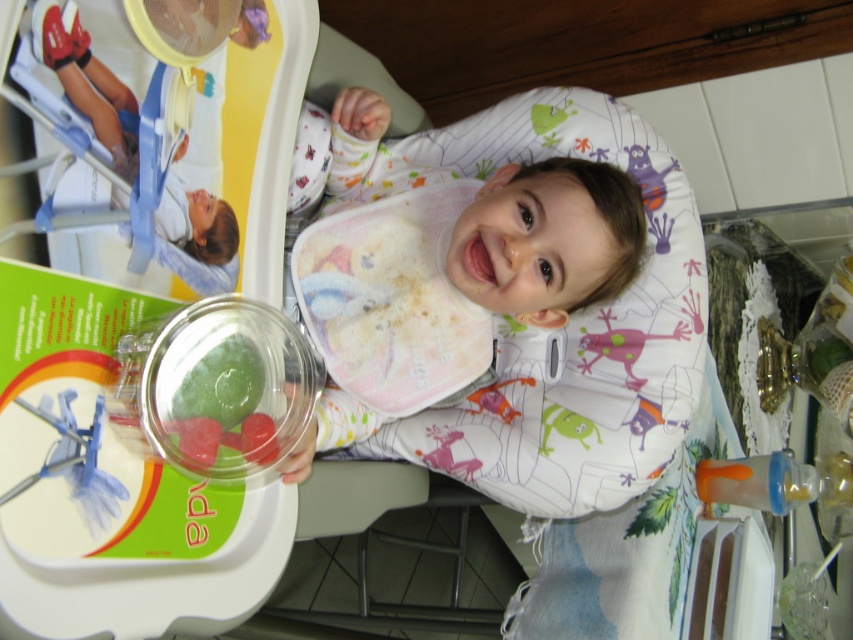
Can you confirm if white fabric bib at center is positioned to the left of green translucent gummy at center?

No, white fabric bib at center is not to the left of green translucent gummy at center.

What do you see at coordinates (548, 240) in the screenshot? The height and width of the screenshot is (640, 853). I see `white fabric bib at center` at bounding box center [548, 240].

What are the coordinates of `white fabric bib at center` in the screenshot? It's located at (548, 240).

Between white fabric bib at center and pink fabric toy at center, which one has more height?

Standing taller between the two is white fabric bib at center.

Measure the distance between point (631, 273) and camera.

A distance of 39.08 inches exists between point (631, 273) and camera.

Locate an element on the screen. Image resolution: width=853 pixels, height=640 pixels. white fabric bib at center is located at coordinates (548, 240).

Which is more to the left, white fabric bib at center or clear plastic spoon at upper left?

clear plastic spoon at upper left is more to the left.

Between point (451, 252) and point (61, 472), which one is positioned behind?

Positioned behind is point (451, 252).

Is point (503, 280) less distant than point (114, 508)?

No, (503, 280) is further to viewer.

Identify the location of white fabric bib at center. Image resolution: width=853 pixels, height=640 pixels. (548, 240).